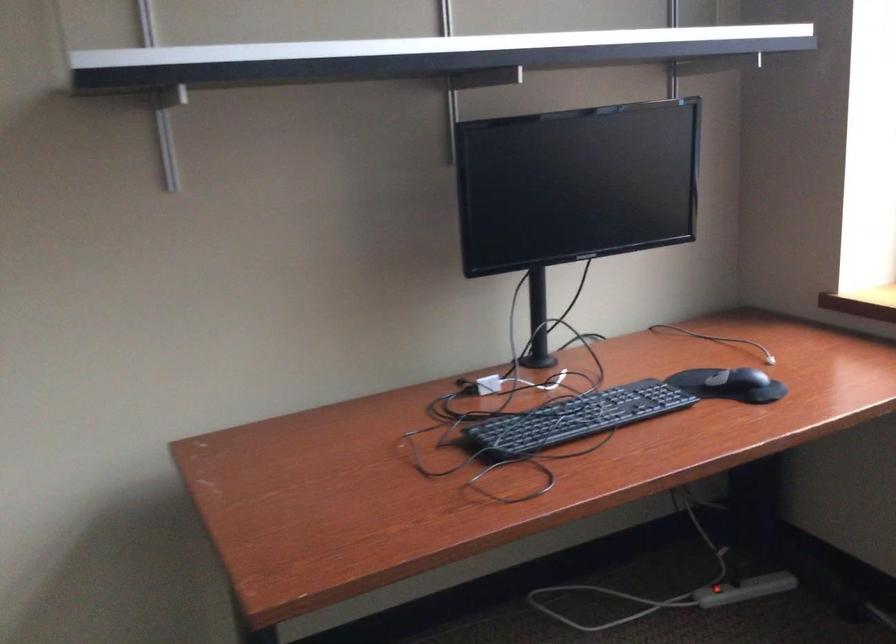
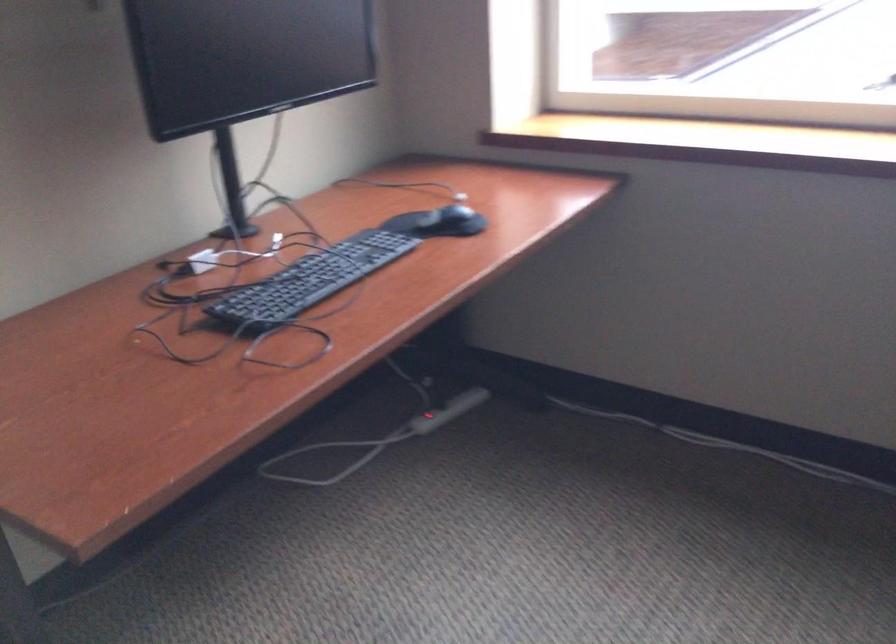
The point at (734, 375) is marked in the first image. Where is the corresponding point in the second image?

(452, 212)